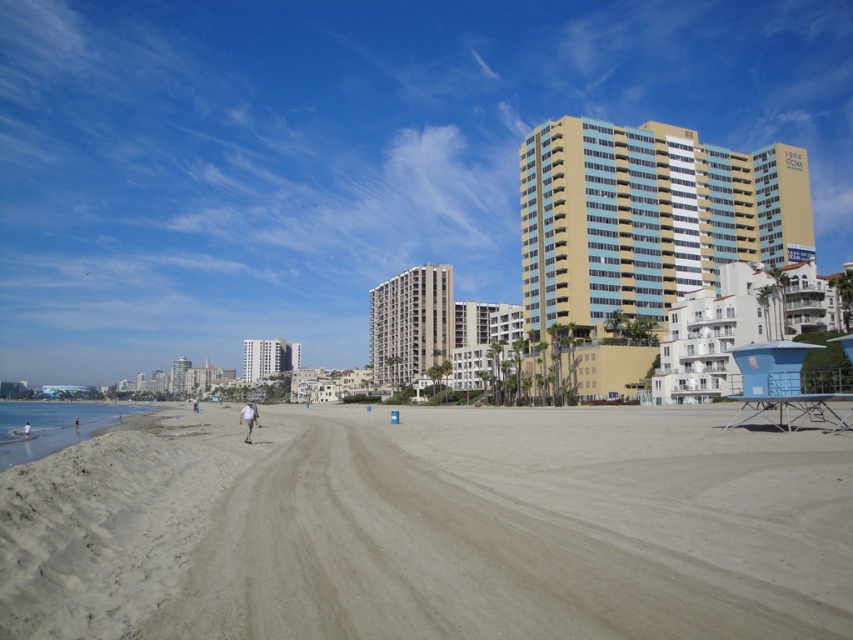
Question: Considering the relative positions of sandy beach at lower left and beige concrete building at center in the image provided, where is sandy beach at lower left located with respect to beige concrete building at center?

Choices:
 (A) above
 (B) below

Answer: (B)

Question: Can you confirm if white stucco building at lower right is positioned above white cotton shorts at lower center?

Choices:
 (A) no
 (B) yes

Answer: (B)

Question: Estimate the real-world distances between objects in this image. Which object is closer to the sandy beach at lower left?

Choices:
 (A) white glossy building at center
 (B) beige concrete building at center
 (C) white cotton shorts at lower center
 (D) smooth sand beach at lower left

Answer: (C)

Question: Considering the real-world distances, which object is farthest from the light beige sand at lower left?

Choices:
 (A) white glossy building at center
 (B) smooth sand beach at lower left
 (C) beige concrete building at center

Answer: (A)

Question: Is beige concrete building at center positioned in front of smooth sand beach at lower left?

Choices:
 (A) no
 (B) yes

Answer: (A)

Question: Which point is farther from the camera taking this photo?

Choices:
 (A) (778, 624)
 (B) (706, 314)
 (C) (425, 368)

Answer: (C)